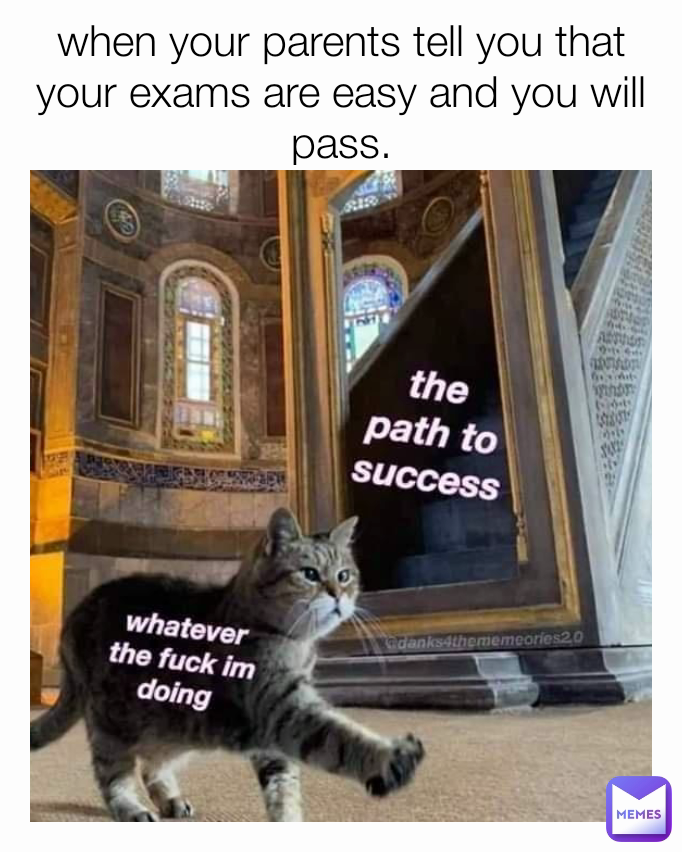
You are a GUI agent. You are given a task and a screenshot of the screen. Output one action in this format:
    pyautogui.click(x=<x>, y=<y>)
    Task: Click on the hand rail
    This screenshot has height=852, width=682.
    Given the screenshot: What is the action you would take?
    pyautogui.click(x=419, y=291), pyautogui.click(x=372, y=344), pyautogui.click(x=621, y=192)